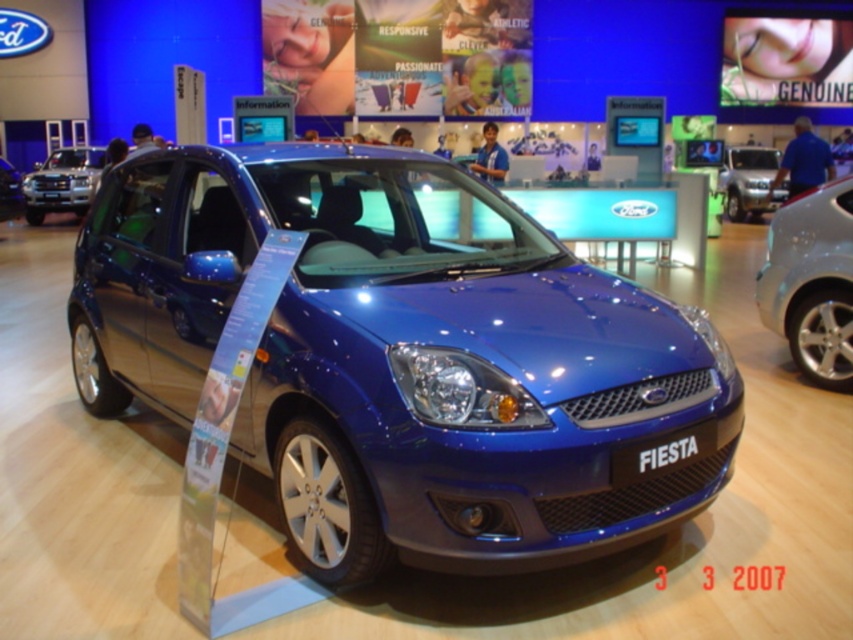
Does satin silver car at right have a larger size compared to glossy blue car at center?

Indeed, satin silver car at right has a larger size compared to glossy blue car at center.

Which is more to the right, satin silver car at right or glossy blue car at center?

Positioned to the right is satin silver car at right.

Image resolution: width=853 pixels, height=640 pixels. What do you see at coordinates (811, 282) in the screenshot?
I see `satin silver car at right` at bounding box center [811, 282].

What are the coordinates of `satin silver car at right` in the screenshot? It's located at (811, 282).

Is satin silver car at right positioned in front of silver metallic minivan at upper right?

Yes, it is.

Based on the photo, can you confirm if satin silver car at right is positioned below silver metallic minivan at upper right?

Yes, satin silver car at right is below silver metallic minivan at upper right.

Is point (786, 243) farther from viewer compared to point (730, 188)?

No, it is not.

Identify the location of satin silver car at right. (811, 282).

Does silver metallic minivan at upper right appear on the left side of glossy blue car at center?

Incorrect, silver metallic minivan at upper right is not on the left side of glossy blue car at center.

Does point (770, 208) come closer to viewer compared to point (12, 164)?

That is True.

Identify the location of silver metallic minivan at upper right. This screenshot has height=640, width=853. 749,180.